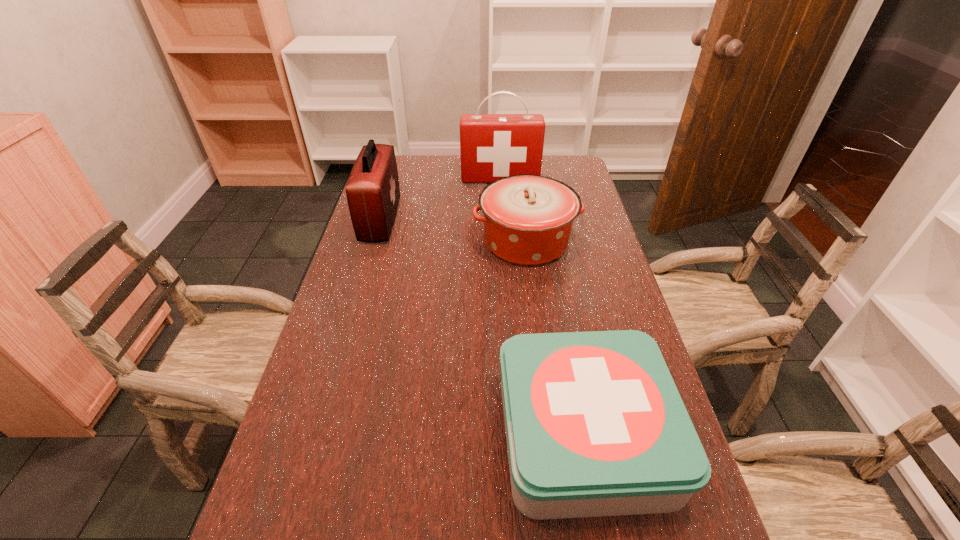
I want to click on vacant region that satisfies the following two spatial constraints: 1. on the side of the shortest object with the cross symbol; 2. on the left side of the leftmost first-aid kit, so click(318, 436).

Where is `vacant space that satisfies the following two spatial constraints: 1. on the side of the third tallest object with the cross symbol; 2. on the left side of the leftmost object`? This screenshot has width=960, height=540. vacant space that satisfies the following two spatial constraints: 1. on the side of the third tallest object with the cross symbol; 2. on the left side of the leftmost object is located at coordinates (374, 241).

The width and height of the screenshot is (960, 540). Identify the location of vacant space that satisfies the following two spatial constraints: 1. on the side of the second nearest first-aid kit with the cross symbol; 2. on the right side of the casserole. (374, 241).

Where is `vacant space that satisfies the following two spatial constraints: 1. on the front face of the third tallest object; 2. on the left side of the tallest first-aid kit`? The height and width of the screenshot is (540, 960). vacant space that satisfies the following two spatial constraints: 1. on the front face of the third tallest object; 2. on the left side of the tallest first-aid kit is located at coordinates (505, 241).

Locate an element on the screen. free point that satisfies the following two spatial constraints: 1. on the front face of the farthest first-aid kit; 2. on the left side of the third tallest object is located at coordinates (505, 241).